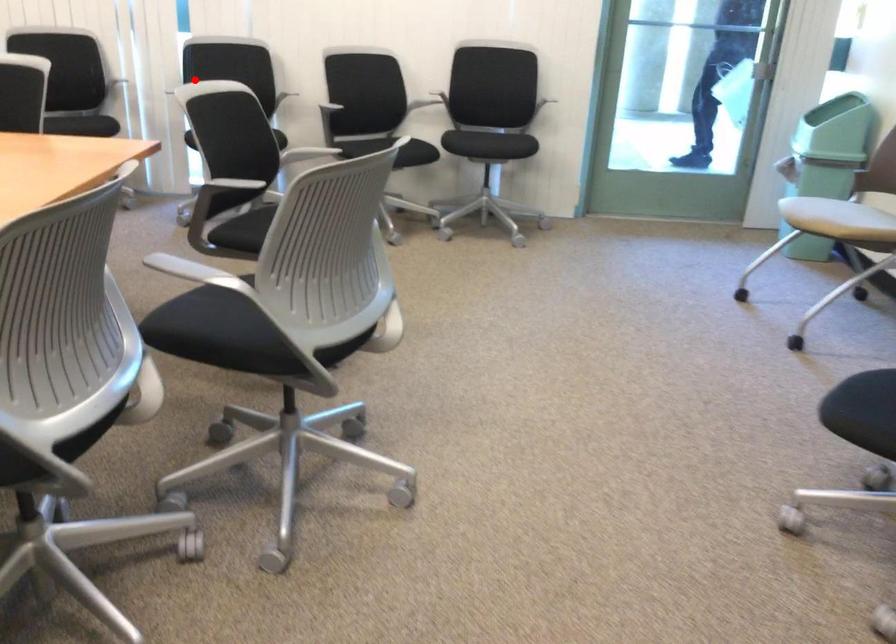
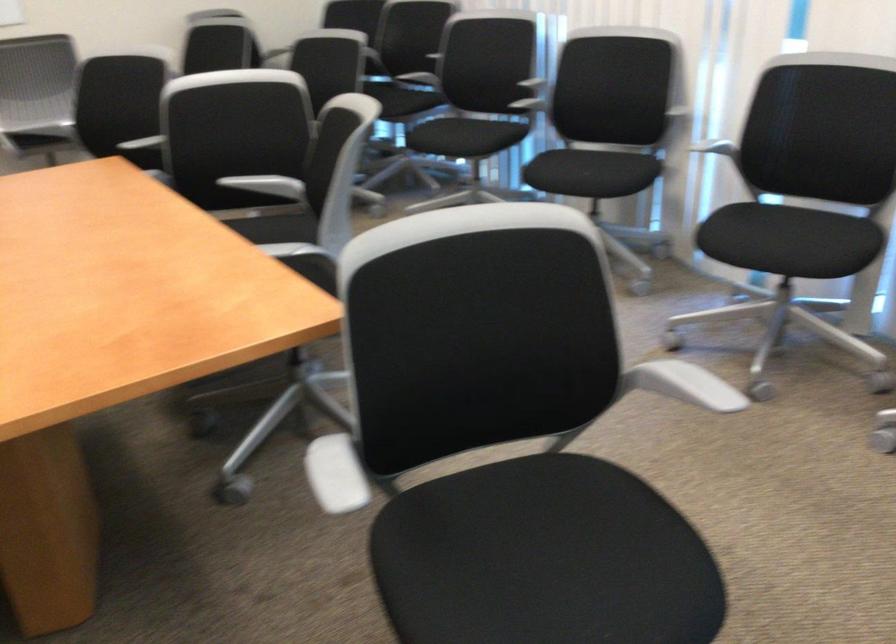
Question: I am providing you with two images of the same scene from different viewpoints. Image1 has a red point marked. In image2, the corresponding 3D location appears at what relative position? Reply with the corresponding letter.

Choices:
 (A) Closer
 (B) Farther

Answer: (A)